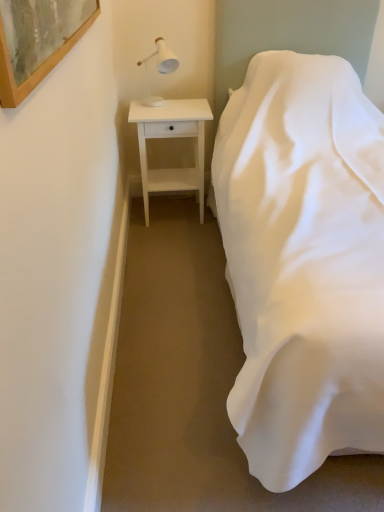
Question: Looking at their shapes, would you say white matte table lamp at upper left is wider or thinner than white wood nightstand at left?

Choices:
 (A) thin
 (B) wide

Answer: (A)

Question: Considering the relative positions of white matte table lamp at upper left and white wood nightstand at left in the image provided, is white matte table lamp at upper left to the left or to the right of white wood nightstand at left?

Choices:
 (A) left
 (B) right

Answer: (A)

Question: Estimate the real-world distances between objects in this image. Which object is farther from the white wood nightstand at left?

Choices:
 (A) white satin bed at right
 (B) white matte table lamp at upper left
 (C) wooden-framed artwork at upper left

Answer: (C)

Question: Which of these objects is positioned farthest from the white matte table lamp at upper left?

Choices:
 (A) white wood nightstand at left
 (B) white satin bed at right
 (C) wooden-framed artwork at upper left

Answer: (C)